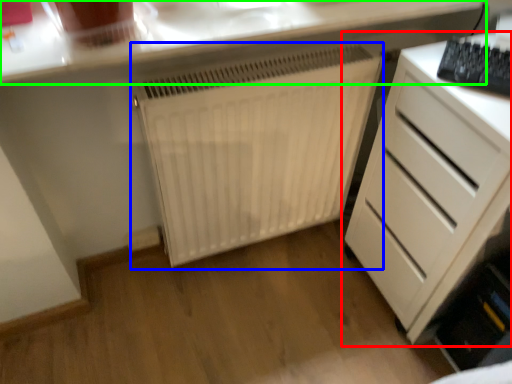
Question: Considering the real-world distances, which object is farthest from chest of drawers (highlighted by a red box)? radiator (highlighted by a blue box) or countertop (highlighted by a green box)?

Choices:
 (A) radiator
 (B) countertop

Answer: (B)